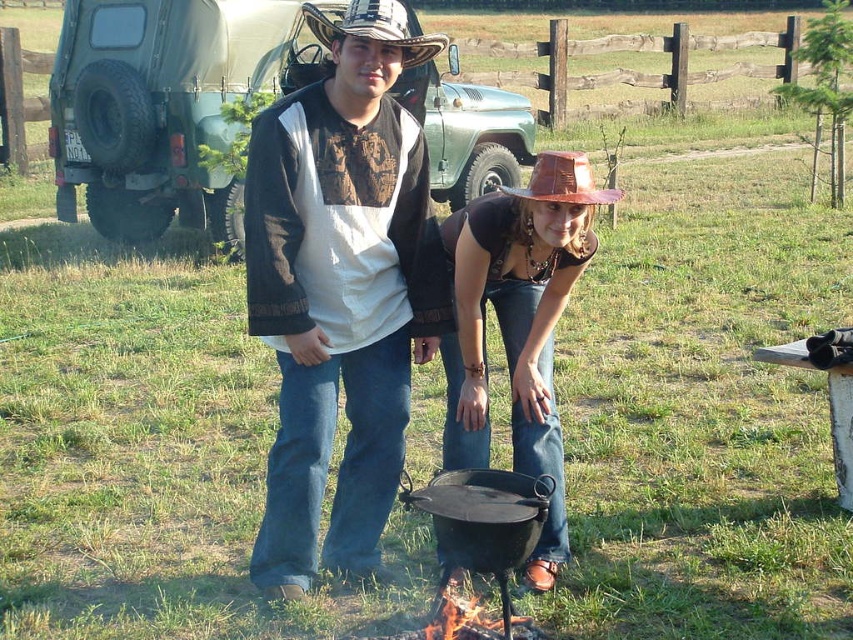
Is matte black jacket at center closer to camera compared to brown leather cowboy hat at center?

Yes.

Based on the photo, who is shorter, matte black jacket at center or brown leather cowboy hat at center?

With less height is brown leather cowboy hat at center.

Locate an element on the screen. Image resolution: width=853 pixels, height=640 pixels. matte black jacket at center is located at coordinates (341, 289).

At what (x,y) coordinates should I click in order to perform the action: click on matte black jacket at center. Please return your answer as a coordinate pair (x, y). Looking at the image, I should click on (341, 289).

Who is taller, brushed metal cowboy hat at upper center or brown leather cowboy hat at center?

brushed metal cowboy hat at upper center

Identify the location of brushed metal cowboy hat at upper center. (376, 28).

Who is more forward, (316, 497) or (546, 211)?

Point (546, 211) is more forward.

Which is more to the right, matte black jacket at center or shiny brown hat at center?

From the viewer's perspective, shiny brown hat at center appears more on the right side.

Is point (370, 316) behind point (467, 388)?

No.

Find the location of a particular element. matte black jacket at center is located at coordinates (341, 289).